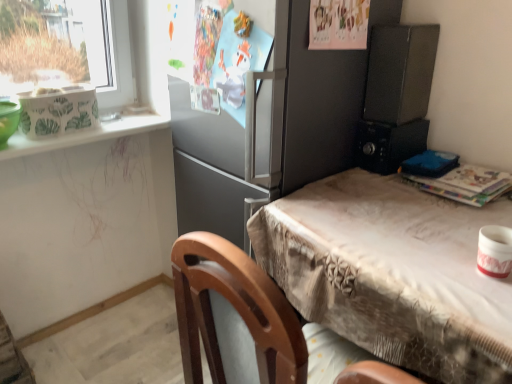
This screenshot has width=512, height=384. Identify the location of empty space that is ontop of beige fabric table at center (from a real-world perspective). (400, 213).